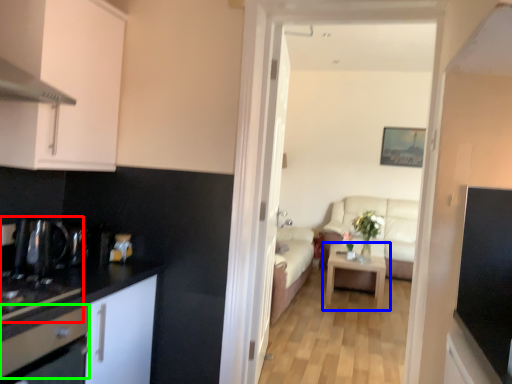
Question: Which is farther away from sink (highlighted by a red box)? table (highlighted by a blue box) or drawer (highlighted by a green box)?

Choices:
 (A) table
 (B) drawer

Answer: (A)